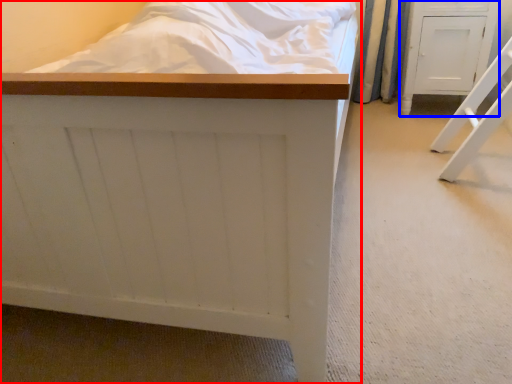
Question: Which of the following is the farthest to the observer, furniture (highlighted by a red box) or furniture (highlighted by a blue box)?

Choices:
 (A) furniture
 (B) furniture

Answer: (B)